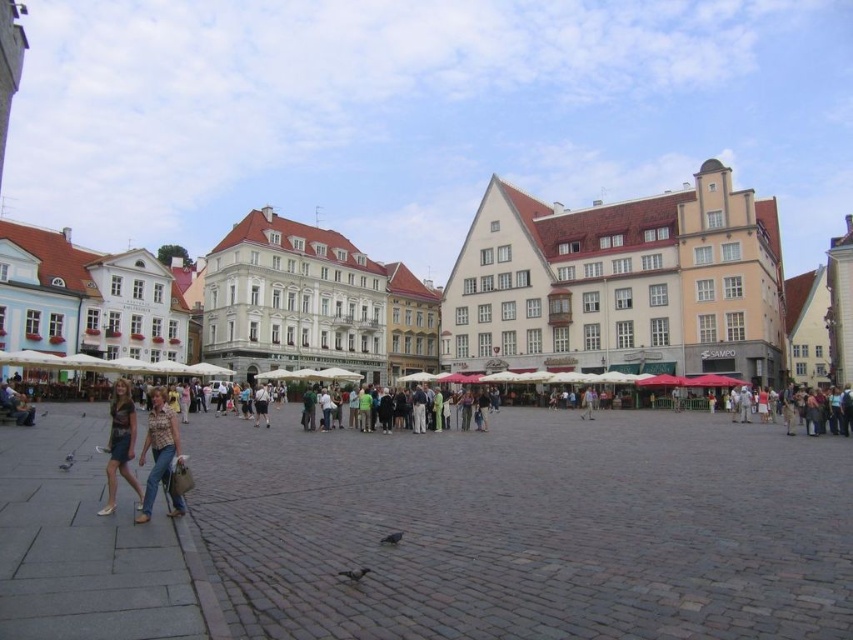
From the picture: You are a photographer standing in the urban square and want to capture both the denim jeans at lower left and the denim skirt at lower left in a single frame. Which item will appear smaller in the photo?

The denim jeans at lower left will appear smaller in the photo because it has a smaller size compared to the denim skirt at lower left.

You are standing in the urban square and notice an item at point (160, 456). What is located at that specific coordinate?

The denim jeans at lower left are located at point (160, 456).

You are standing at the point with coordinates point [135,419] in the urban square. Looking towards the buildings, can you see the point with coordinates point [560,225]?

Point [560,225] is behind point [135,419], so you cannot see it from your current position.